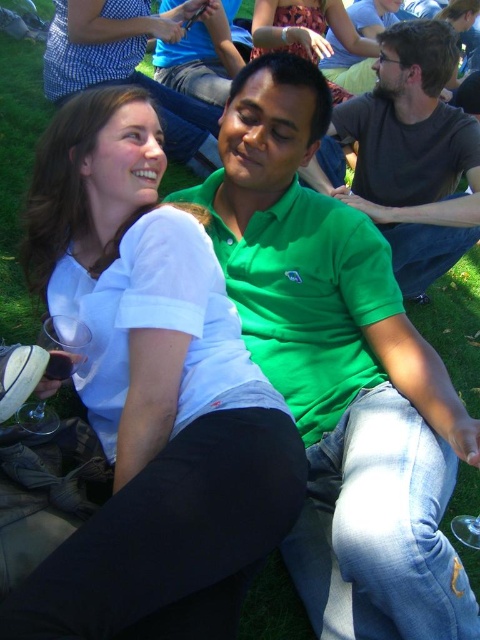
You are organizing a picnic and need to decide which item to place in a small storage box that can only accommodate items narrower than 10 cm. You have the green matte shirt at center and the clear plastic cup at lower left. Based on their sizes, which item should you choose?

The clear plastic cup at lower left should be chosen because the green matte shirt at center is wider than it, and the cup is narrower than 10 cm.

You are a photographer trying to capture a candid shot of the green cotton shirt at center and the transparent plastic wine glass at lower left. If you want to ensure both subjects are in focus, which one should you focus on first considering their sizes?

The green cotton shirt at center is taller than the transparent plastic wine glass at lower left, so you should focus on the green cotton shirt at center first because it is larger and more prominent in the frame.